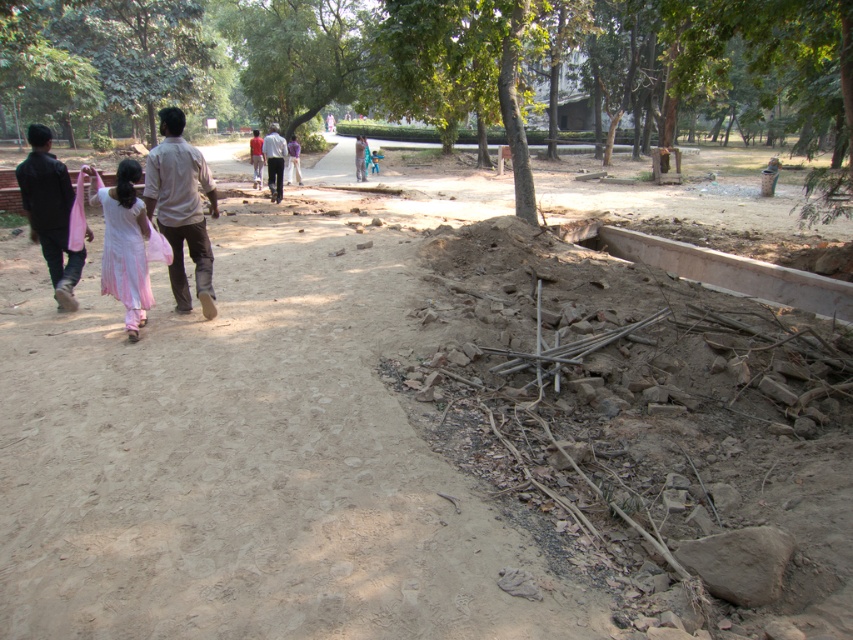
Question: Which is farther from the light beige cotton shirt at center?

Choices:
 (A) white cotton dress at left
 (B) black matte jacket at left
 (C) light brown shirt at center

Answer: (C)

Question: Can you confirm if light brown shirt at center is thinner than black matte jacket at left?

Choices:
 (A) yes
 (B) no

Answer: (A)

Question: Is white cotton dress at left thinner than light beige cotton shirt at center?

Choices:
 (A) no
 (B) yes

Answer: (B)

Question: Which of the following is the farthest from the observer?

Choices:
 (A) (277, 173)
 (B) (53, 230)
 (C) (123, 240)

Answer: (A)

Question: Among these points, which one is nearest to the camera?

Choices:
 (A) (177, 259)
 (B) (57, 266)

Answer: (A)

Question: Does light brown shirt at center have a greater width compared to black matte jacket at left?

Choices:
 (A) yes
 (B) no

Answer: (B)